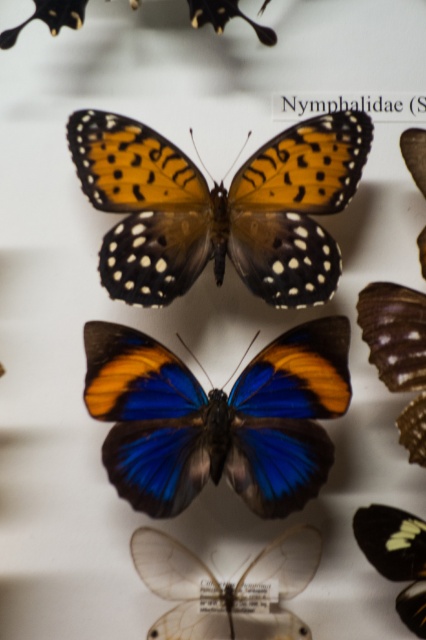
Question: Considering the real-world distances, which object is farthest from the translucent white butterfly at lower right?

Choices:
 (A) shiny blue butterfly at center
 (B) transparent plastic wings at center

Answer: (A)

Question: Can you confirm if shiny blue butterfly at center is positioned to the left of translucent white butterfly at lower right?

Choices:
 (A) yes
 (B) no

Answer: (A)

Question: Can you confirm if transparent plastic wings at center is bigger than translucent white butterfly at lower right?

Choices:
 (A) yes
 (B) no

Answer: (A)

Question: Which object is closer to the camera taking this photo?

Choices:
 (A) orange-patterned butterfly at center
 (B) shiny blue butterfly at center
 (C) transparent plastic wings at center
 (D) translucent white butterfly at lower right

Answer: (D)

Question: Among these objects, which one is farthest from the camera?

Choices:
 (A) translucent white butterfly at lower right
 (B) orange-patterned butterfly at center
 (C) shiny blue butterfly at center

Answer: (B)

Question: In this image, where is orange-patterned butterfly at center located relative to transparent plastic wings at center?

Choices:
 (A) below
 (B) above

Answer: (B)